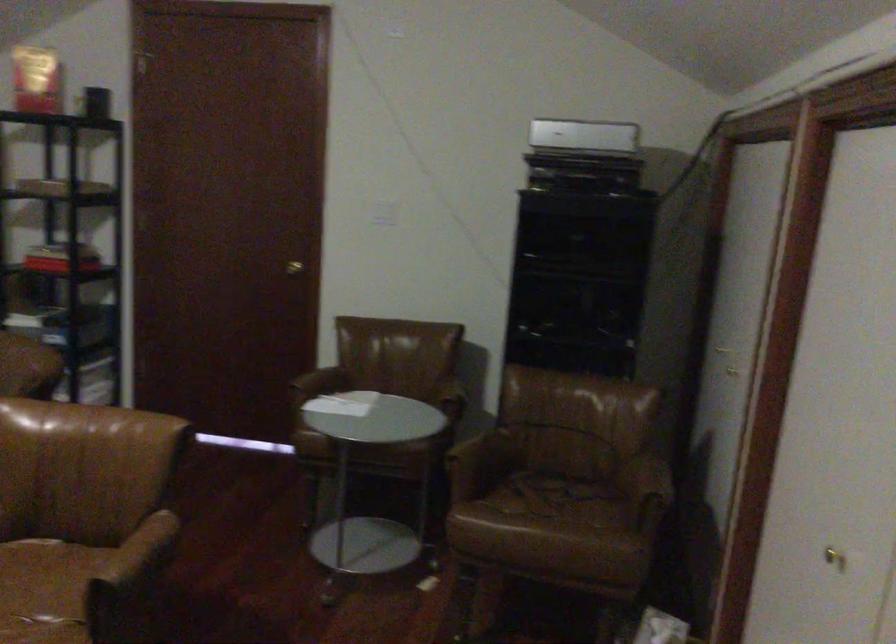
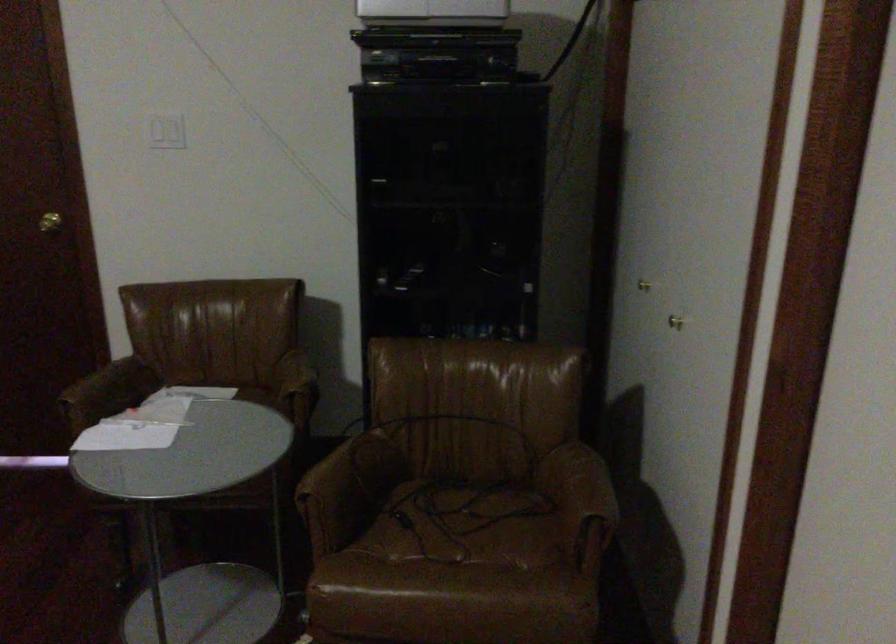
Find the pixel in the second image that matches (557,500) in the first image.

(464, 525)